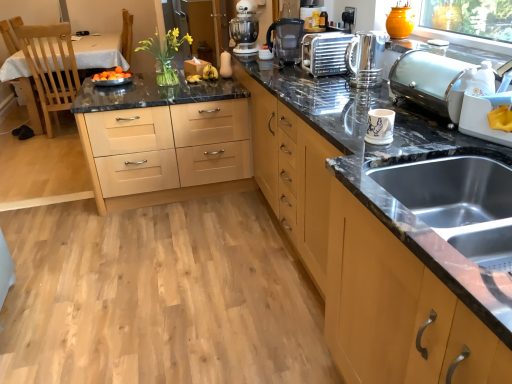
The height and width of the screenshot is (384, 512). Identify the location of free point to the left of shiny metallic kettle at upper right. (325, 85).